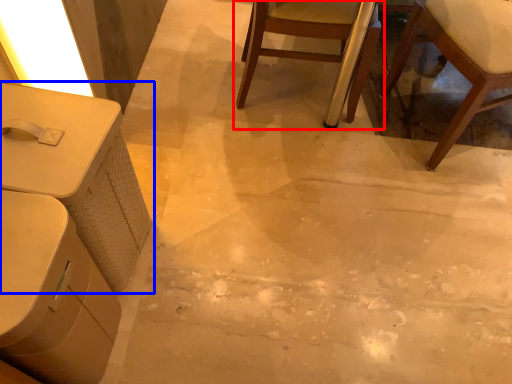
Question: Which of the following is the closest to the observer, chair (highlighted by a red box) or table (highlighted by a blue box)?

Choices:
 (A) chair
 (B) table

Answer: (B)